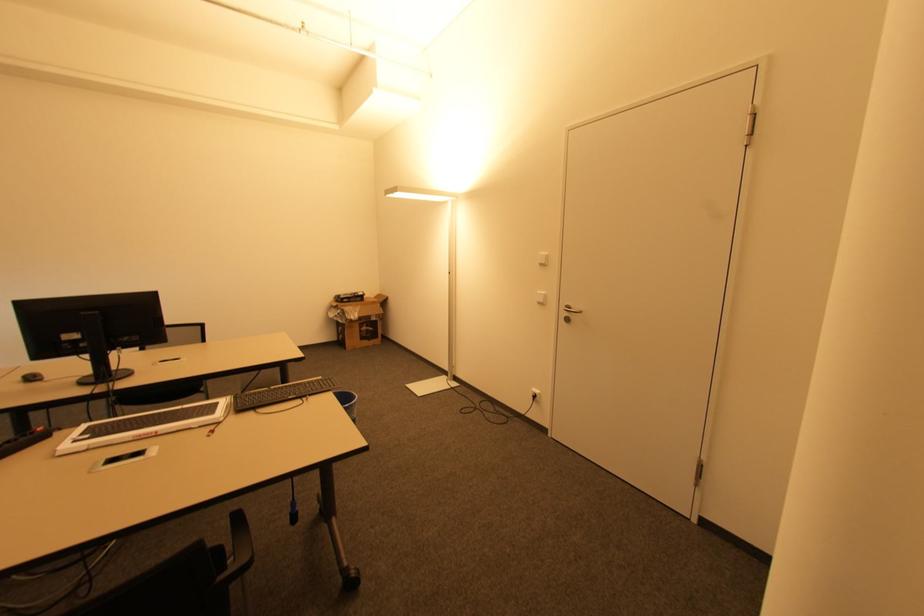
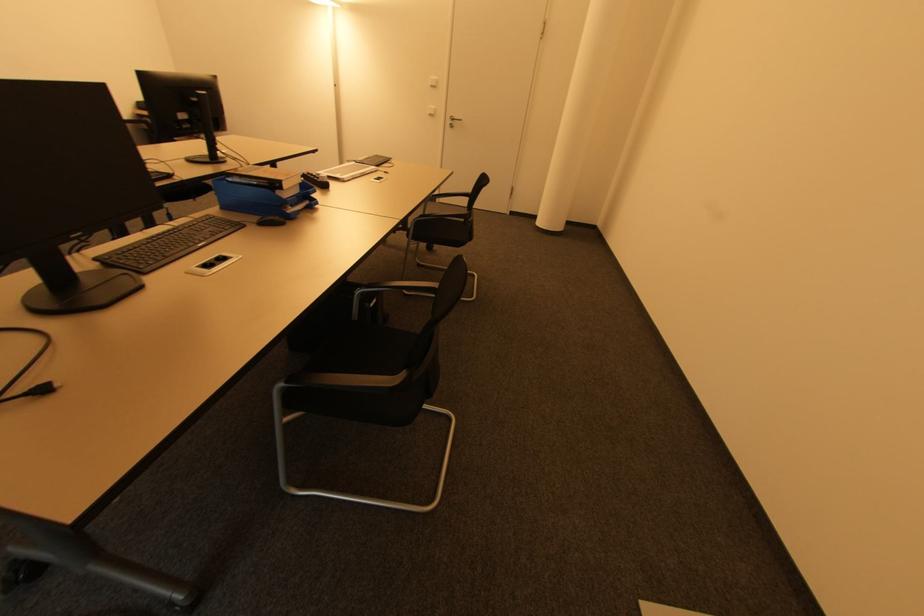
Locate, in the second image, the point that corresponds to point (568, 320) in the first image.

(454, 127)